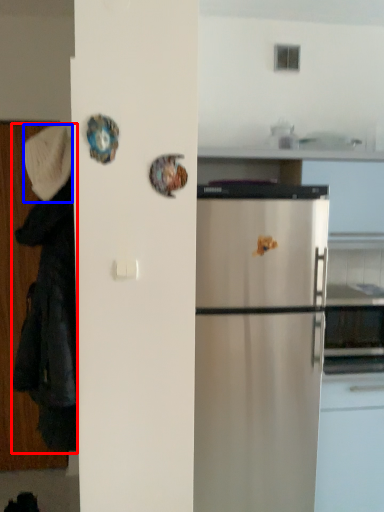
Question: Among these objects, which one is nearest to the camera, couple (highlighted by a red box) or hat (highlighted by a blue box)?

Choices:
 (A) couple
 (B) hat

Answer: (A)